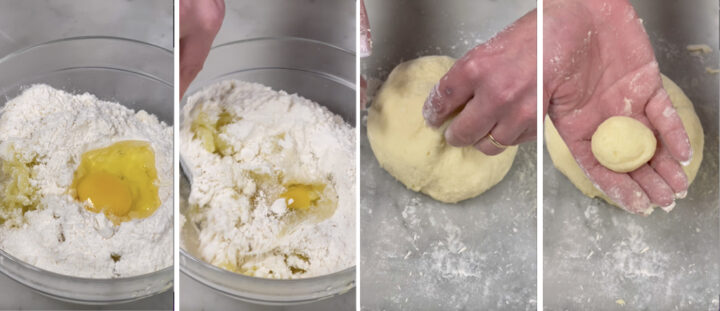
I want to click on clear bowl, so click(x=120, y=81), click(x=291, y=61).